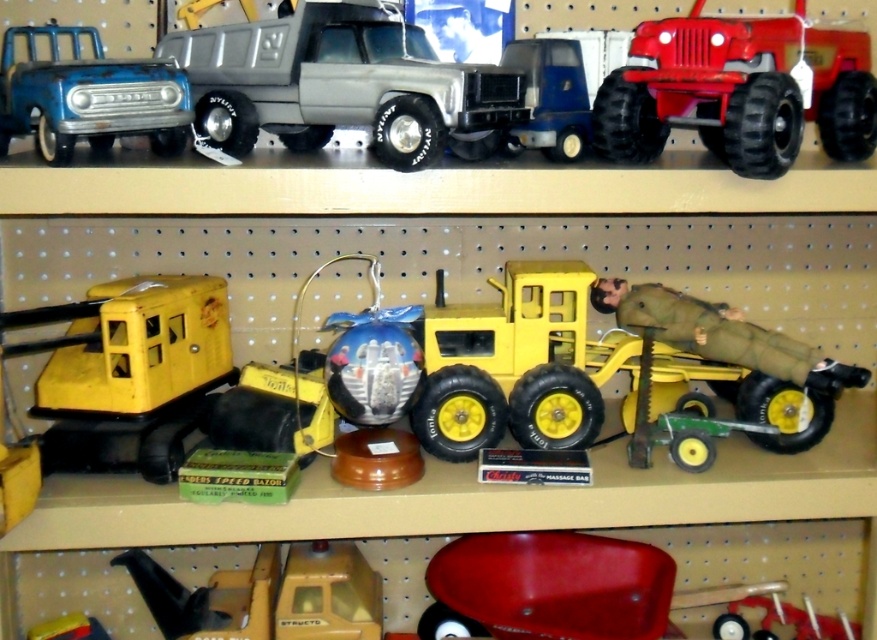
Is shiny red plastic jeep at upper right to the left of yellow matte truck at center from the viewer's perspective?

Incorrect, shiny red plastic jeep at upper right is not on the left side of yellow matte truck at center.

In order to click on shiny red plastic jeep at upper right in this screenshot , I will do `click(738, 92)`.

I want to click on shiny red plastic jeep at upper right, so click(x=738, y=92).

Looking at this image, is matte plastic truck at center positioned behind yellow matte truck at center?

No, matte plastic truck at center is closer to the viewer.

Is point (233, 68) closer to camera compared to point (309, 634)?

Yes.

Find the location of `matte plastic truck at center`. matte plastic truck at center is located at coordinates (341, 84).

Consider the image. Does shiny red plastic jeep at upper right come behind matte blue truck at upper left?

No.

At what (x,y) coordinates should I click in order to perform the action: click on shiny red plastic jeep at upper right. Please return your answer as a coordinate pair (x, y). Looking at the image, I should click on coord(738,92).